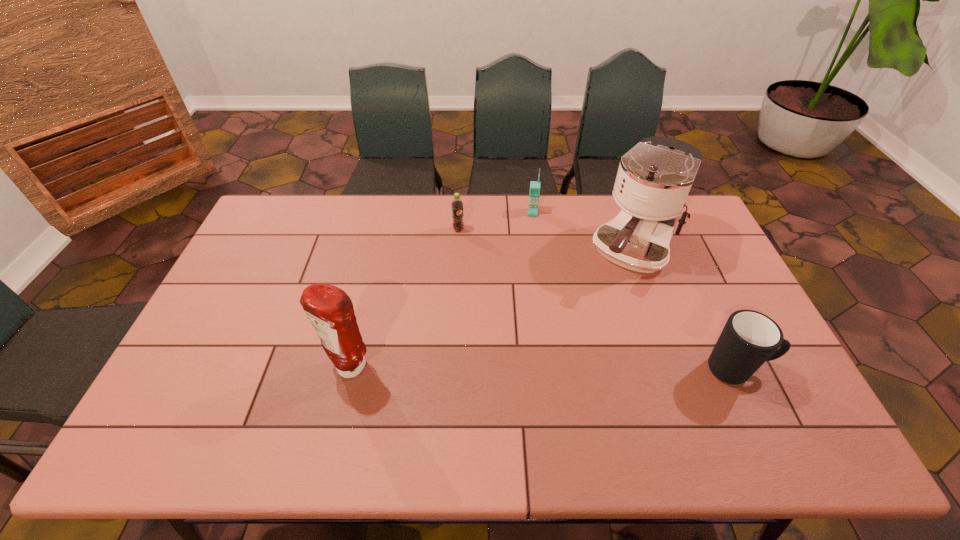
The height and width of the screenshot is (540, 960). What are the coordinates of `vacant space on the desktop that is between the second tallest object and the mug and is positioned on the front-facing side of the tallest object` in the screenshot? It's located at (554, 369).

Identify the location of free spot on the desktop that is between the condiment and the mug and is positioned on the front label of the second object from left to right. This screenshot has width=960, height=540. (568, 369).

You are a GUI agent. You are given a task and a screenshot of the screen. Output one action in this format:
    pyautogui.click(x=<x>, y=<y>)
    Task: Click on the free spot on the desktop that is between the condiment and the mug and is positioned on the keypad of the cellular telephone
    The width and height of the screenshot is (960, 540).
    Given the screenshot: What is the action you would take?
    pyautogui.click(x=523, y=369)